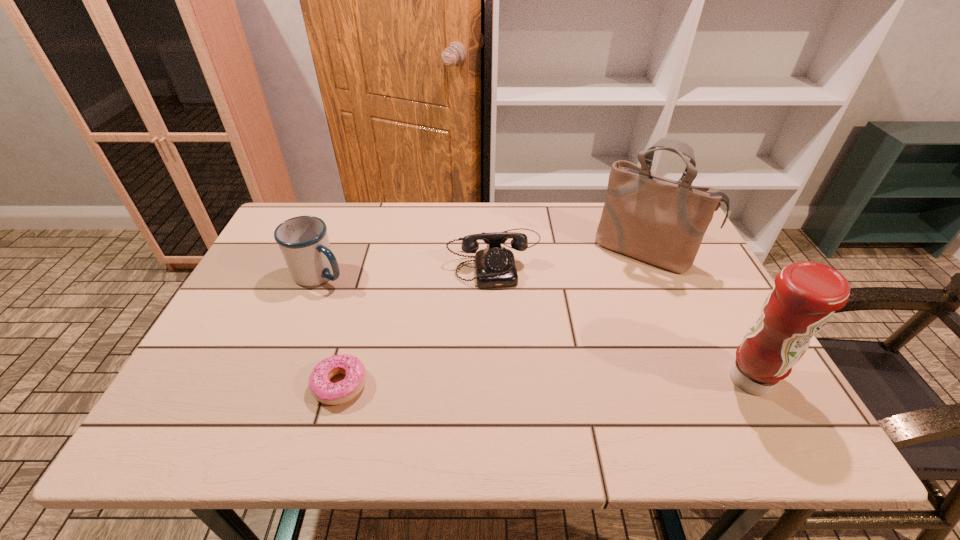
The height and width of the screenshot is (540, 960). In order to click on the fourth object from right to left in this screenshot , I will do point(321,388).

At what (x,y) coordinates should I click in order to perform the action: click on the shortest object. Please return your answer as a coordinate pair (x, y). The height and width of the screenshot is (540, 960). Looking at the image, I should click on click(x=321, y=388).

Find the location of a particular element. This screenshot has height=540, width=960. the fourth shortest object is located at coordinates (806, 295).

In order to click on shoulder bag in this screenshot , I will do `click(657, 220)`.

The width and height of the screenshot is (960, 540). Find the location of `the third object from left to right`. the third object from left to right is located at coordinates (495, 267).

The height and width of the screenshot is (540, 960). In order to click on telephone in this screenshot , I will do `click(495, 267)`.

Locate an element on the screen. This screenshot has width=960, height=540. mug is located at coordinates (303, 240).

Where is `the leftmost object`? the leftmost object is located at coordinates pyautogui.click(x=303, y=240).

The width and height of the screenshot is (960, 540). Find the location of `vacant space located 0.280m on the back of the doughnut`. vacant space located 0.280m on the back of the doughnut is located at coordinates pos(369,280).

At what (x,y) coordinates should I click in order to perform the action: click on vacant point located on the back of the condiment. Please return your answer as a coordinate pair (x, y). Looking at the image, I should click on (693, 274).